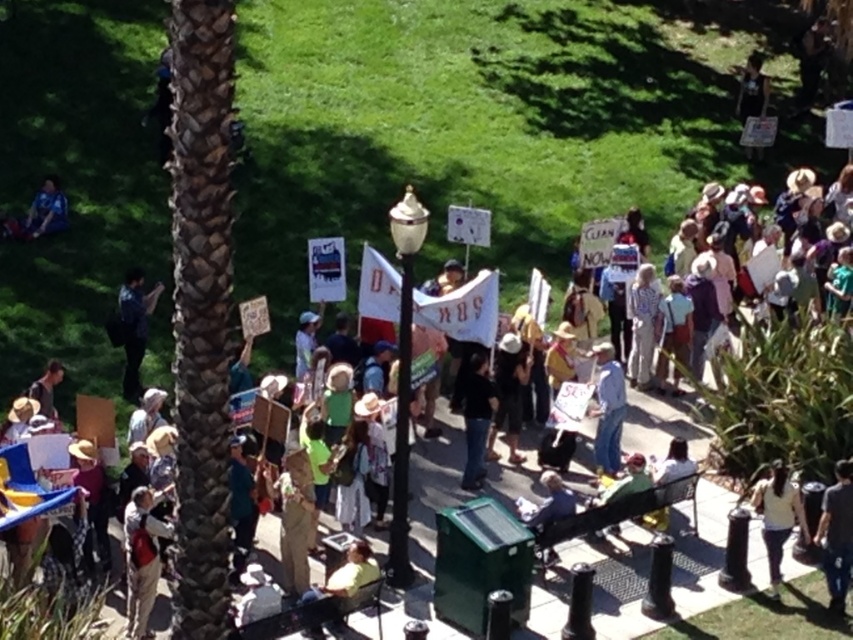
Between point (599, 467) and point (38, 232), which one is positioned in front?

Positioned in front is point (599, 467).

Is blue jeans at center positioned behind blue fabric shirt at upper left?

No.

Image resolution: width=853 pixels, height=640 pixels. What do you see at coordinates (608, 410) in the screenshot?
I see `blue jeans at center` at bounding box center [608, 410].

Image resolution: width=853 pixels, height=640 pixels. In order to click on blue jeans at center in this screenshot , I will do `click(608, 410)`.

Is dark blue jeans at lower right positioned before blue fabric shirt at upper left?

Yes.

Locate an element on the screen. The height and width of the screenshot is (640, 853). dark blue jeans at lower right is located at coordinates (836, 536).

Is point (836, 472) positioned behind point (38, 227)?

No, (836, 472) is in front of (38, 227).

I want to click on dark blue jeans at lower right, so click(x=836, y=536).

Who is positioned more to the left, light yellow shirt at lower right or blue fabric shirt at upper left?

blue fabric shirt at upper left is more to the left.

Between light yellow shirt at lower right and blue fabric shirt at upper left, which one has less height?

With less height is blue fabric shirt at upper left.

The image size is (853, 640). In order to click on light yellow shirt at lower right in this screenshot , I will do `click(776, 516)`.

This screenshot has width=853, height=640. I want to click on light yellow shirt at lower right, so click(776, 516).